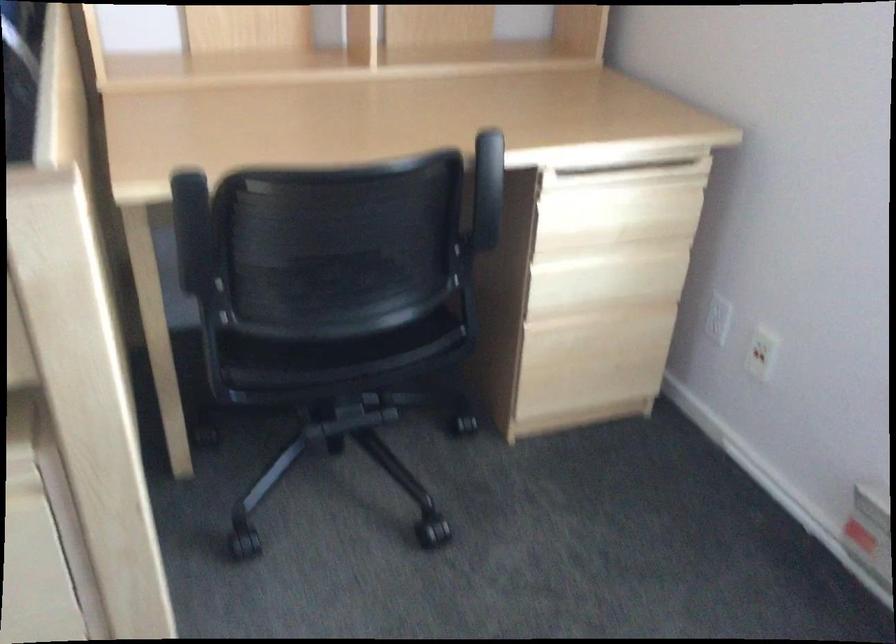
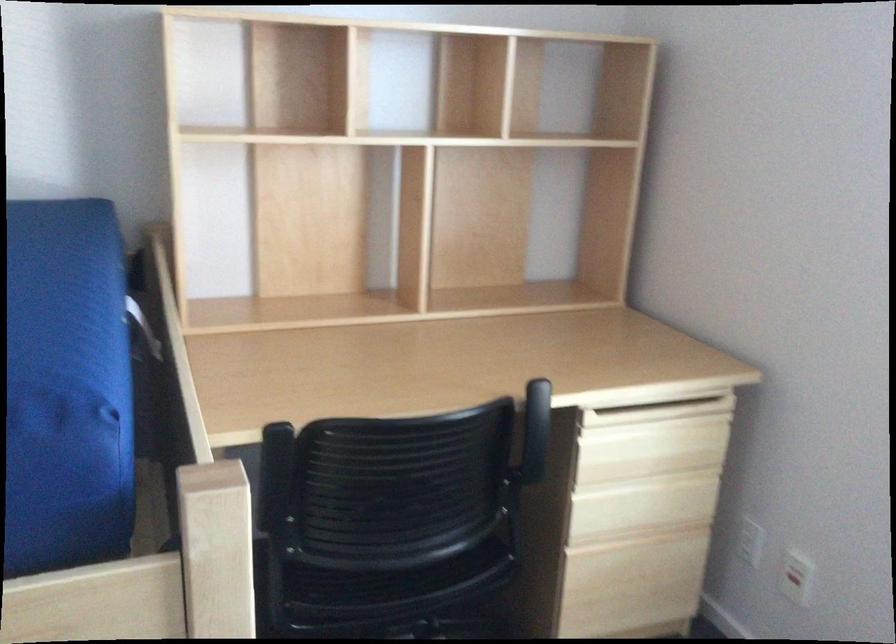
In the second image, find the point that corresponds to (x=194, y=230) in the first image.

(273, 474)